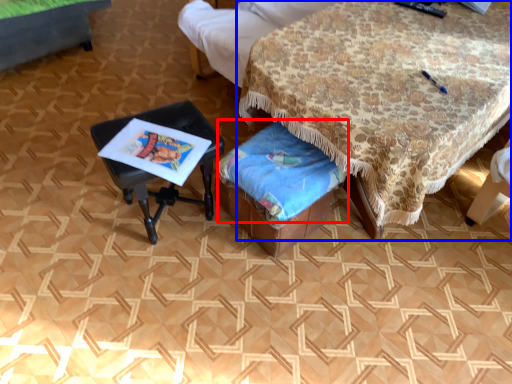
Question: Which object is closer to the camera taking this photo, blanket (highlighted by a red box) or table (highlighted by a blue box)?

Choices:
 (A) blanket
 (B) table

Answer: (B)